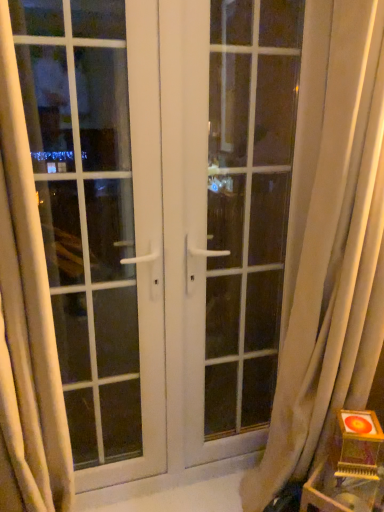
Question: From the image's perspective, does white glass window at center appear lower than wooden table at lower right?

Choices:
 (A) no
 (B) yes

Answer: (A)

Question: Considering the relative sizes of white glass window at center and wooden table at lower right in the image provided, is white glass window at center taller than wooden table at lower right?

Choices:
 (A) yes
 (B) no

Answer: (A)

Question: Does white glass window at center have a larger size compared to wooden table at lower right?

Choices:
 (A) no
 (B) yes

Answer: (B)

Question: Is white glass window at center next to wooden table at lower right and touching it?

Choices:
 (A) yes
 (B) no

Answer: (B)

Question: Can we say white glass window at center lies outside wooden table at lower right?

Choices:
 (A) yes
 (B) no

Answer: (A)

Question: In the image, is white sheer curtain at right, acting as the 2th curtain starting from the left, positioned in front of or behind wooden table at lower right?

Choices:
 (A) front
 (B) behind

Answer: (A)

Question: Which is correct: white sheer curtain at right, acting as the 2th curtain starting from the left, is inside wooden table at lower right, or outside of it?

Choices:
 (A) inside
 (B) outside

Answer: (B)

Question: From a real-world perspective, is white sheer curtain at right, acting as the 2th curtain starting from the left, physically located above or below wooden table at lower right?

Choices:
 (A) above
 (B) below

Answer: (A)

Question: Considering the positions of white sheer curtain at right, the first curtain in the right-to-left sequence, and wooden table at lower right in the image, is white sheer curtain at right, the first curtain in the right-to-left sequence, taller or shorter than wooden table at lower right?

Choices:
 (A) short
 (B) tall

Answer: (B)

Question: Considering the positions of point (215, 32) and point (130, 39), is point (215, 32) closer or farther from the camera than point (130, 39)?

Choices:
 (A) farther
 (B) closer

Answer: (A)

Question: Is white glossy door at center to the left or to the right of white glass window at center in the image?

Choices:
 (A) left
 (B) right

Answer: (B)

Question: Based on their sizes in the image, would you say white glossy door at center is bigger or smaller than white glass window at center?

Choices:
 (A) small
 (B) big

Answer: (B)

Question: In the image, is white glossy door at center positioned in front of or behind white glass window at center?

Choices:
 (A) front
 (B) behind

Answer: (B)

Question: Is white glossy door at center taller or shorter than white sheer curtain at left, the 1th curtain viewed from the left?

Choices:
 (A) short
 (B) tall

Answer: (B)

Question: Is point (215, 92) positioned closer to the camera than point (41, 394)?

Choices:
 (A) farther
 (B) closer

Answer: (A)